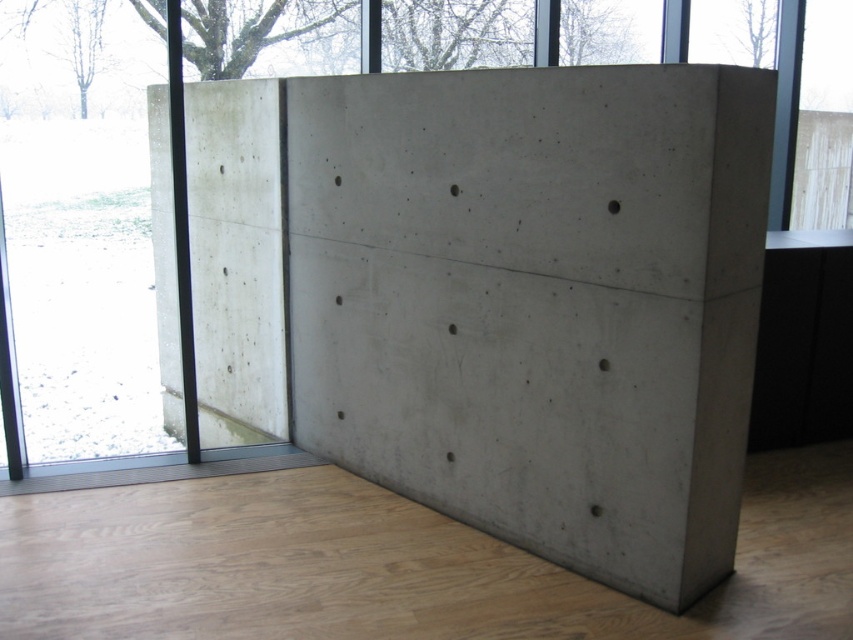
Question: Among these objects, which one is nearest to the camera?

Choices:
 (A) gray concrete wall at center
 (B) transparent glass door at left

Answer: (A)

Question: Which point appears closest to the camera in this image?

Choices:
 (A) (515, 452)
 (B) (22, 428)

Answer: (A)

Question: Does gray concrete wall at center have a smaller size compared to transparent glass door at left?

Choices:
 (A) no
 (B) yes

Answer: (A)

Question: Can you confirm if gray concrete wall at center is bigger than transparent glass door at left?

Choices:
 (A) no
 (B) yes

Answer: (B)

Question: From the image, what is the correct spatial relationship of gray concrete wall at center in relation to transparent glass door at left?

Choices:
 (A) right
 (B) left

Answer: (A)